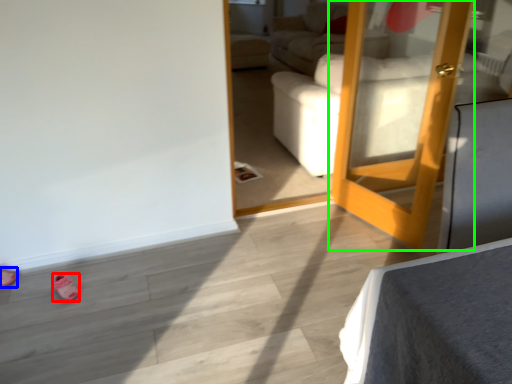
Question: Estimate the real-world distances between objects in this image. Which object is closer to shoe (highlighted by a red box), shoe (highlighted by a blue box) or door (highlighted by a green box)?

Choices:
 (A) shoe
 (B) door

Answer: (A)